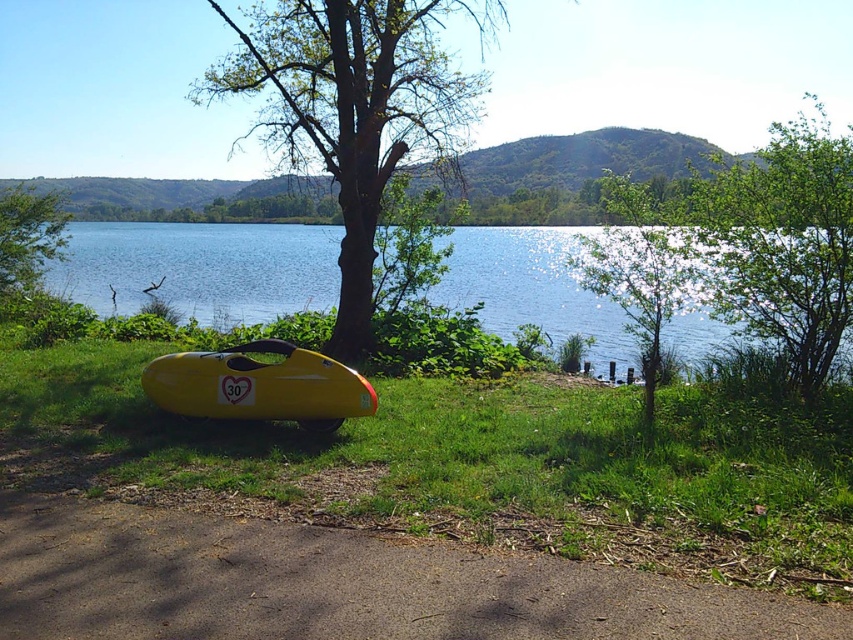
You are planning to transport both the yellow matte boat at lower center and the green matte tree at lower left using a truck that can carry items up to 2 meters in width. Given their widths, can both items fit side by side in the truck bed?

The yellow matte boat at lower center is narrower than the green matte tree at lower left. However, since the total width of both items combined is not provided, we cannot determine if they can fit side by side in the truck bed that allows up to 2 meters in width.

You are standing at the edge of the lake and want to find the yellow kayak. According to the scene, where is the green grass at center in relation to the green leafy tree at upper right?

The green grass at center is located below the green leafy tree at upper right, so the grass is positioned under the tree in the image.

You are standing at the edge of the lake and want to take a photo of the green leafy tree at upper right without the green grass at center blocking the view. How should you position yourself to achieve this?

Move behind the green grass at center so that the green leafy tree at upper right is visible without obstruction.